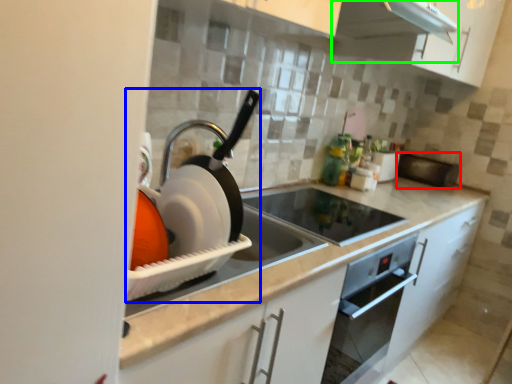
Question: Estimate the real-world distances between objects in this image. Which object is farther from appliance (highlighted by a red box), appliance (highlighted by a blue box) or exhaust hood (highlighted by a green box)?

Choices:
 (A) appliance
 (B) exhaust hood

Answer: (A)